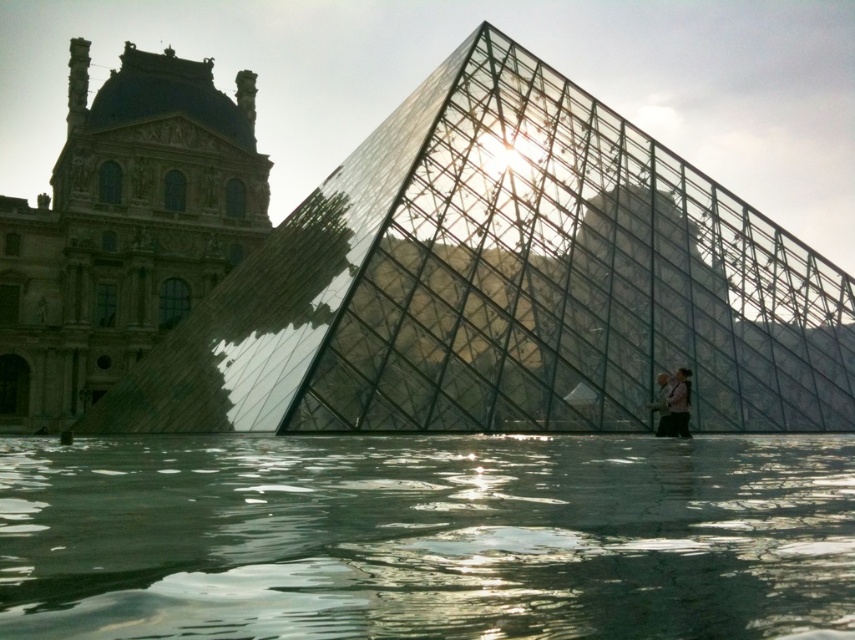
You are standing at the entrance of the Louvre Museum and want to take a photo of the transparent glass pyramid at center. However, there is a pink fabric person at lower right blocking your view. Can you estimate if the person is closer to the camera than the pyramid?

The transparent glass pyramid at center has a larger size compared to pink fabric person at lower right. Since the pyramid appears larger in the image, it is likely closer to the camera than the pink fabric person at lower right. Therefore, the person is farther away and might not be blocking the view significantly.

You are standing in front of the Louvre Pyramid and want to take a photo of both the transparent glass pyramid at center and the light brown leather jacket at lower right. Which object should you position closer to the left side of your camera frame to include both in the shot?

To include both the transparent glass pyramid at center and the light brown leather jacket at lower right in your photo, position the transparent glass pyramid at center closer to the left side of your camera frame since it is already on the left side of the light brown leather jacket at lower right.